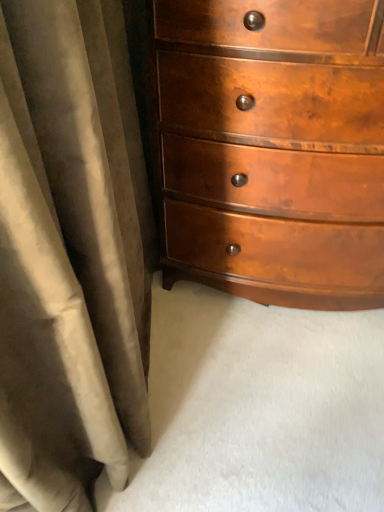
At what (x,y) coordinates should I click in order to perform the action: click on shiny brown wood chest of drawers at right. Please return your answer as a coordinate pair (x, y). This screenshot has width=384, height=512. Looking at the image, I should click on (273, 148).

Describe the element at coordinates (273, 148) in the screenshot. I see `shiny brown wood chest of drawers at right` at that location.

Locate an element on the screen. The image size is (384, 512). shiny brown wood chest of drawers at right is located at coordinates (273, 148).